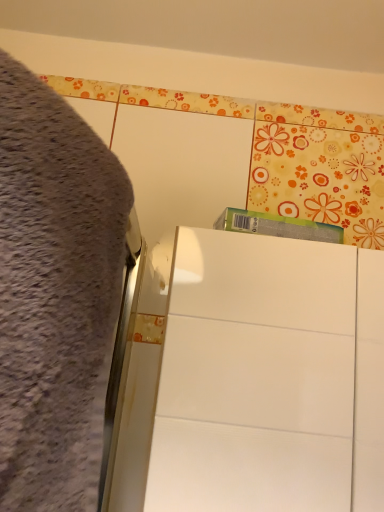
Describe the element at coordinates (55, 294) in the screenshot. I see `gray fuzzy bath towel at left` at that location.

Where is `gray fuzzy bath towel at left`? gray fuzzy bath towel at left is located at coordinates (55, 294).

You are a GUI agent. You are given a task and a screenshot of the screen. Output one action in this format:
    pyautogui.click(x=<x>, y=<y>)
    Task: Click on the gray fuzzy bath towel at left
    Image resolution: width=384 pixels, height=512 pixels.
    Given the screenshot: What is the action you would take?
    pyautogui.click(x=55, y=294)